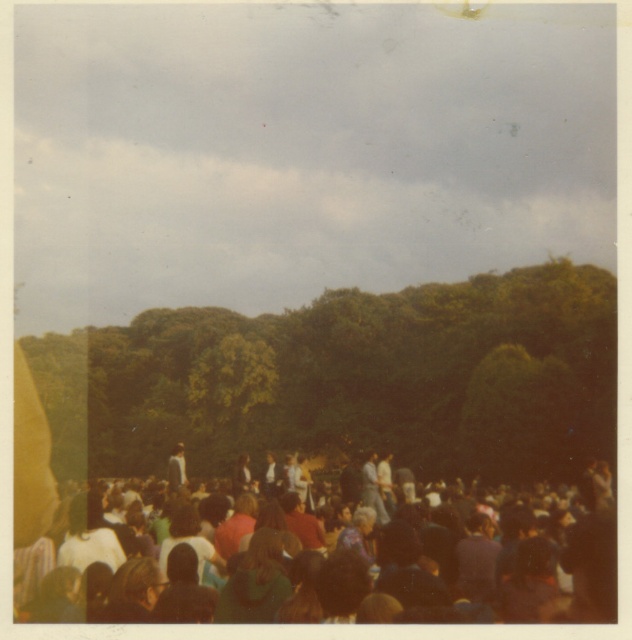
Question: Which point is farther to the camera?

Choices:
 (A) (276, 340)
 (B) (418, 609)

Answer: (A)

Question: Is green leafy tree at center wider than multicolored fabric crowd at lower center?

Choices:
 (A) no
 (B) yes

Answer: (B)

Question: Does green leafy tree at center have a greater width compared to multicolored fabric crowd at lower center?

Choices:
 (A) yes
 (B) no

Answer: (A)

Question: Which point is farther to the camera?

Choices:
 (A) green leafy tree at center
 (B) multicolored fabric crowd at lower center

Answer: (A)

Question: In this image, where is green leafy tree at center located relative to multicolored fabric crowd at lower center?

Choices:
 (A) below
 (B) above

Answer: (B)

Question: Which point appears farthest from the camera in this image?

Choices:
 (A) (94, 620)
 (B) (356, 406)

Answer: (B)